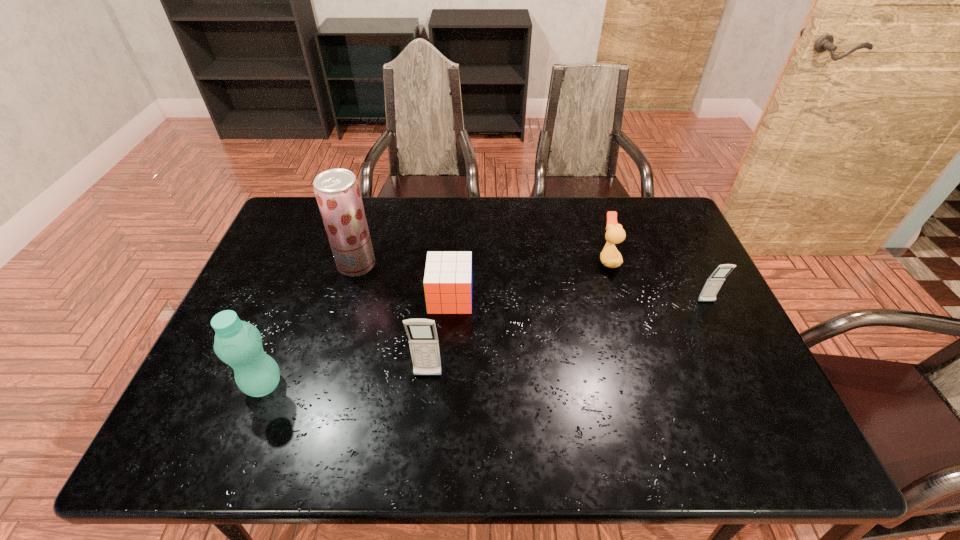
At what (x,y) coordinates should I click in order to perform the action: click on free space between the rightmost object and the duck. Please return your answer as a coordinate pair (x, y). The width and height of the screenshot is (960, 540). Looking at the image, I should click on (658, 281).

I want to click on free spot between the bottle and the fruit juice, so click(x=310, y=325).

Locate an element on the screen. free space that is in between the duck and the taller cellular telephone is located at coordinates pyautogui.click(x=518, y=318).

Locate an element on the screen. Image resolution: width=960 pixels, height=540 pixels. unoccupied area between the rightmost object and the leftmost object is located at coordinates (485, 343).

At what (x,y) coordinates should I click in order to perform the action: click on free point between the shorter cellular telephone and the cube. Please return your answer as a coordinate pair (x, y). Looking at the image, I should click on (579, 300).

Identify the location of vacant space that is in between the right cellular telephone and the left cellular telephone. This screenshot has height=540, width=960. (567, 339).

Where is `free space between the rightmost object and the tallest object`? This screenshot has width=960, height=540. free space between the rightmost object and the tallest object is located at coordinates (532, 284).

This screenshot has width=960, height=540. What are the coordinates of `vacant area that lies between the fruit juice and the bottle` in the screenshot? It's located at (310, 325).

Choose which object is the fifth nearest neighbor to the nearer cellular telephone. Please provide its 2D coordinates. Your answer should be formatted as a tuple, i.e. [(x, y)], where the tuple contains the x and y coordinates of a point satisfying the conditions above.

[(713, 284)]

Choose which object is the nearest neighbor to the duck. Please provide its 2D coordinates. Your answer should be formatted as a tuple, i.e. [(x, y)], where the tuple contains the x and y coordinates of a point satisfying the conditions above.

[(713, 284)]